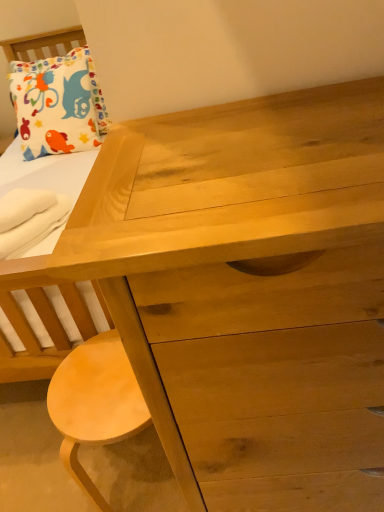
The width and height of the screenshot is (384, 512). Find the location of `free spot above light brown wood stool at lower left (from a real-world perspective)`. free spot above light brown wood stool at lower left (from a real-world perspective) is located at coordinates [x=96, y=387].